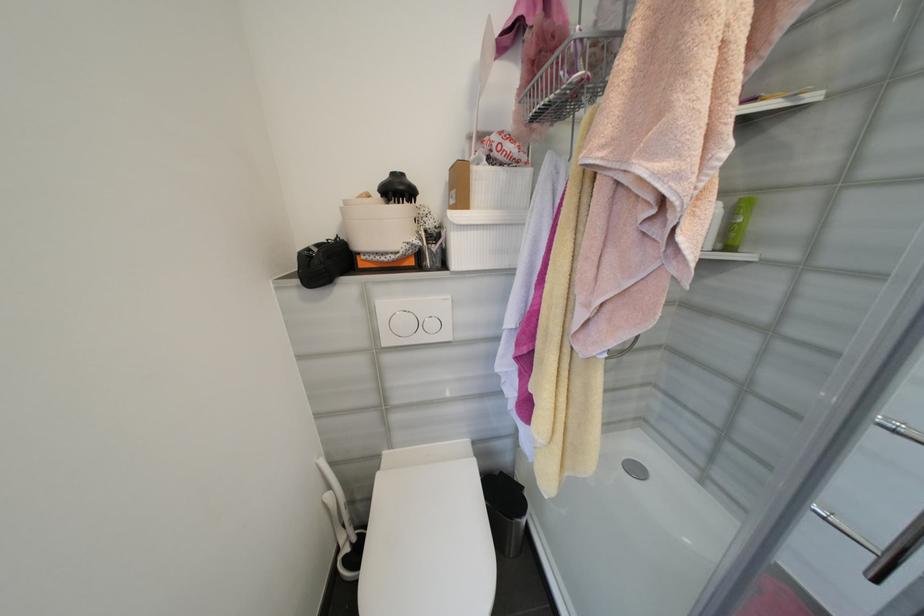
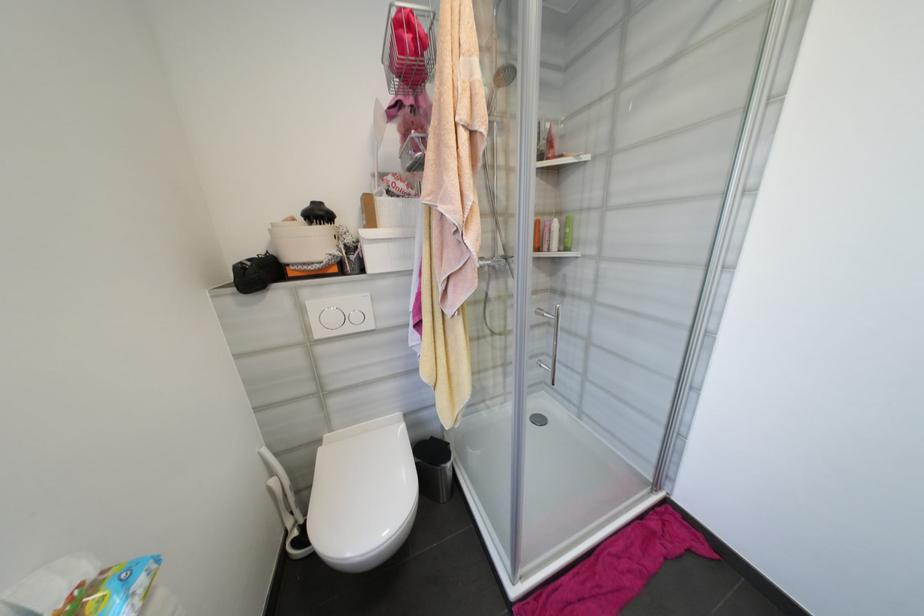
Locate, in the second image, the point that corresponds to (x=351, y=204) in the first image.

(280, 225)